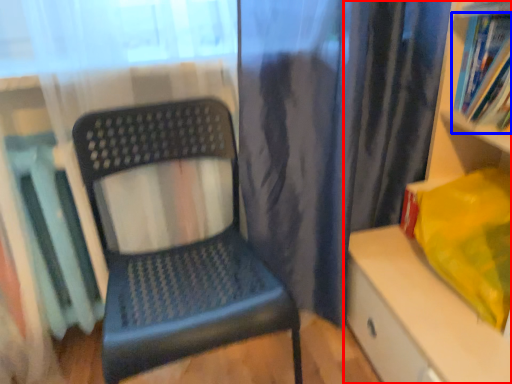
Question: Which point is further to the camera, shelf (highlighted by a red box) or book (highlighted by a blue box)?

Choices:
 (A) shelf
 (B) book

Answer: (B)